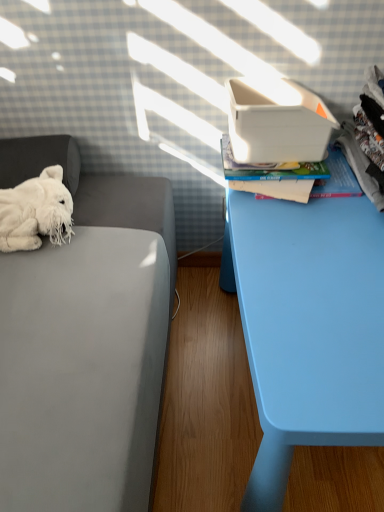
I want to click on free space in front of white plastic shoe box at upper right, so click(x=298, y=224).